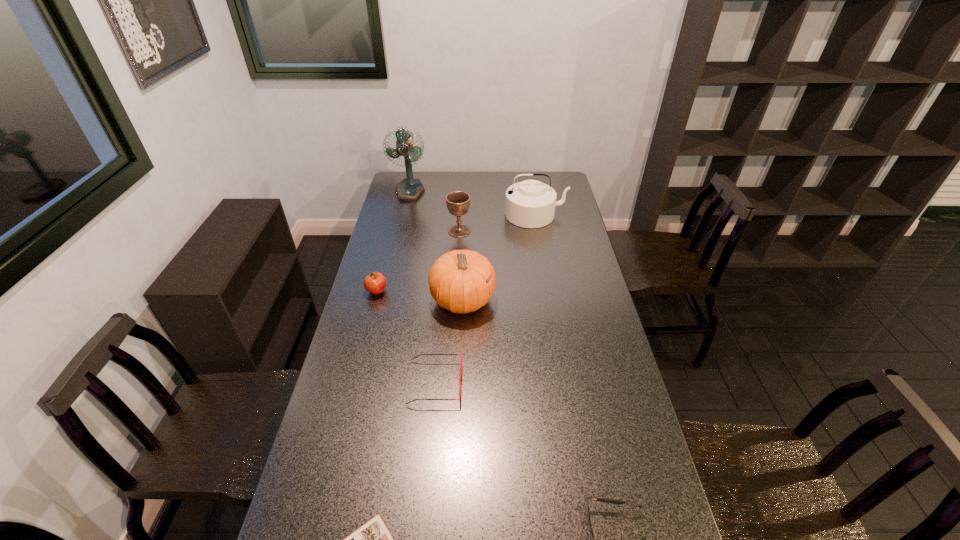
Locate an element on the screen. fan is located at coordinates (409, 189).

Locate an element on the screen. the tallest object is located at coordinates [409, 189].

Where is `pumpkin`? This screenshot has height=540, width=960. pumpkin is located at coordinates (457, 280).

Where is `kettle`? kettle is located at coordinates (529, 204).

Locate an element on the screen. The image size is (960, 540). the fourth tallest object is located at coordinates (458, 202).

Where is `apple`? The width and height of the screenshot is (960, 540). apple is located at coordinates (375, 283).

The image size is (960, 540). In order to click on spectacles in this screenshot , I will do `click(421, 354)`.

This screenshot has height=540, width=960. In order to click on the third nearest object in this screenshot , I will do `click(421, 354)`.

Locate an element on the screen. This screenshot has width=960, height=540. vacant area located in front of the tallest object where the wind blows is located at coordinates (405, 212).

At what (x,y) coordinates should I click in order to perform the action: click on free location located 0.100m on the front-facing side of the pumpkin. Please return your answer as a coordinate pair (x, y). Looking at the image, I should click on tap(521, 300).